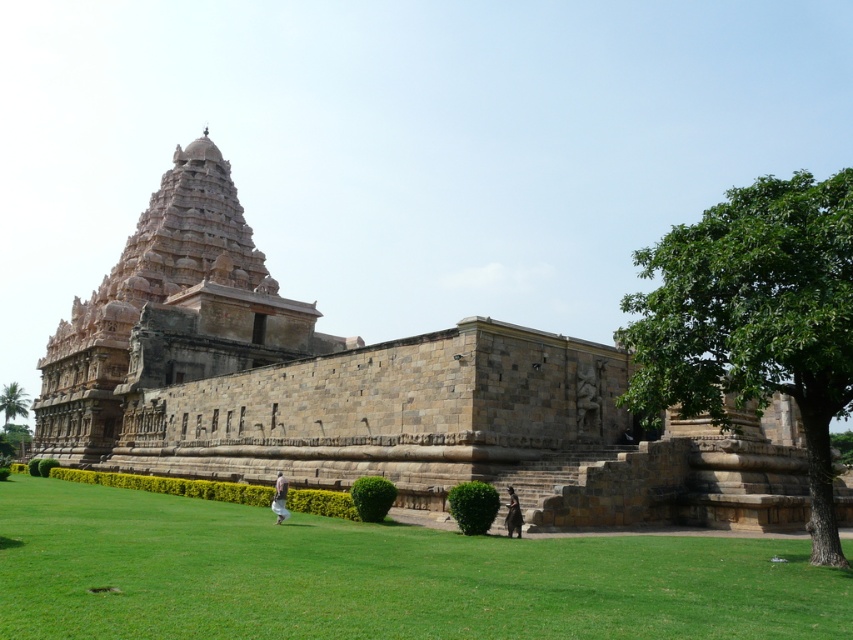
Question: Which of the following is the closest to the observer?

Choices:
 (A) brown stone temple at center
 (B) green grass at lower center
 (C) stone carved temple at center
 (D) green leafy tree at right

Answer: (B)

Question: Which object is positioned closest to the green grass at lower center?

Choices:
 (A) dark brown fabric at lower center
 (B) brown stone temple at center
 (C) white cotton pants at lower center
 (D) green leafy tree at lower left

Answer: (A)

Question: Does stone carved temple at center appear under dark brown fabric at lower center?

Choices:
 (A) yes
 (B) no

Answer: (B)

Question: Is stone carved temple at center thinner than dark brown fabric at lower center?

Choices:
 (A) no
 (B) yes

Answer: (A)

Question: Which point is closer to the camera?

Choices:
 (A) white cotton pants at lower center
 (B) green leafy tree at lower left

Answer: (A)

Question: Is green grass at lower center to the left of dark brown fabric at lower center from the viewer's perspective?

Choices:
 (A) yes
 (B) no

Answer: (A)